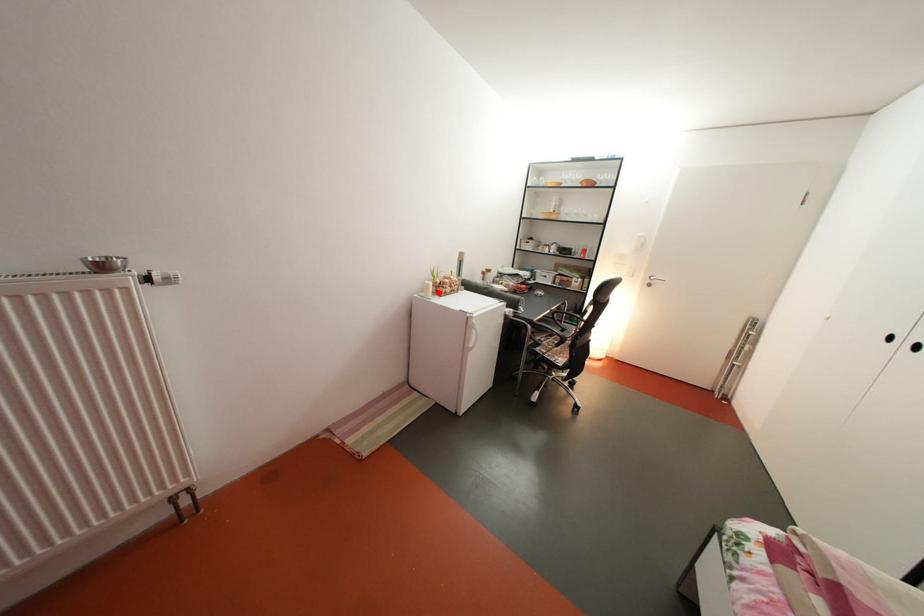
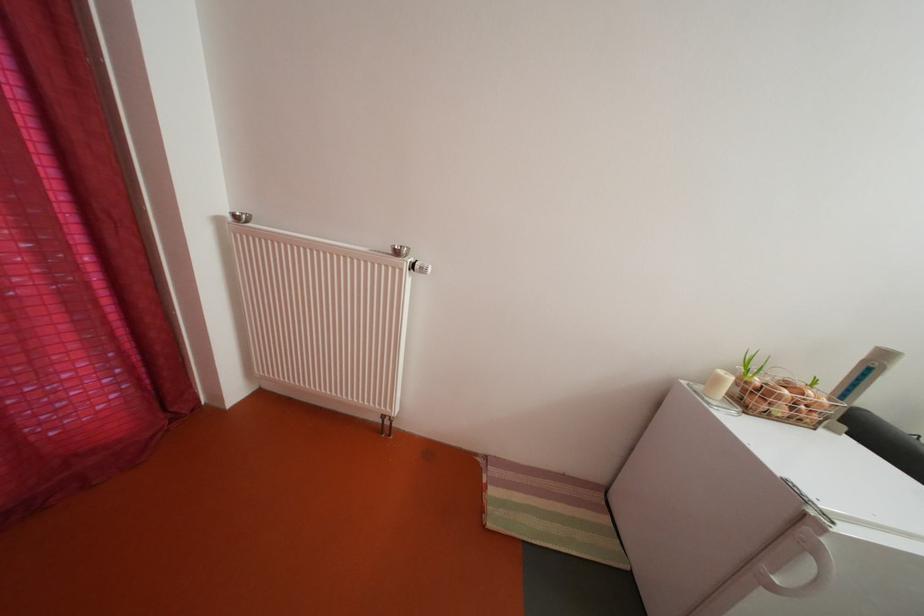
In the second image, find the point that corresponds to the highlighted location in the first image.

(728, 386)